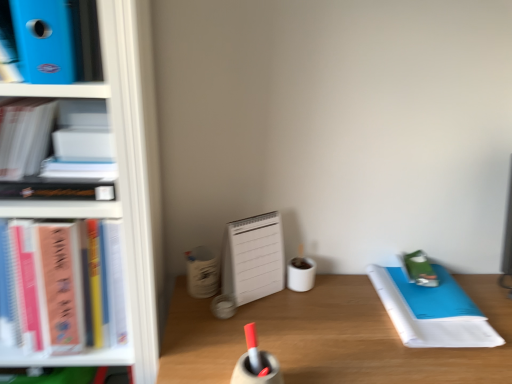
Question: Is wooden desk at center shorter than white paper notebook at right?

Choices:
 (A) yes
 (B) no

Answer: (B)

Question: Is wooden desk at center not within white paper notebook at right?

Choices:
 (A) yes
 (B) no

Answer: (A)

Question: From the image's perspective, is wooden desk at center over white paper notebook at right?

Choices:
 (A) no
 (B) yes

Answer: (A)

Question: Can you confirm if wooden desk at center is bigger than white paper notebook at right?

Choices:
 (A) no
 (B) yes

Answer: (B)

Question: Considering the relative sizes of wooden desk at center and white paper notebook at right in the image provided, is wooden desk at center smaller than white paper notebook at right?

Choices:
 (A) no
 (B) yes

Answer: (A)

Question: From a real-world perspective, is green matte notebook at right physically located above or below wooden desk at center?

Choices:
 (A) below
 (B) above

Answer: (B)

Question: Is green matte notebook at right situated inside wooden desk at center or outside?

Choices:
 (A) outside
 (B) inside

Answer: (A)

Question: Considering the relative positions of green matte notebook at right and wooden desk at center in the image provided, is green matte notebook at right to the left or to the right of wooden desk at center?

Choices:
 (A) left
 (B) right

Answer: (B)

Question: Is green matte notebook at right taller or shorter than wooden desk at center?

Choices:
 (A) short
 (B) tall

Answer: (A)

Question: Is white paper notebook at right in front of or behind pink matte notebook at left, arranged as the 1th book when ordered from the bottom, in the image?

Choices:
 (A) behind
 (B) front

Answer: (A)

Question: Considering the positions of white paper notebook at right and pink matte notebook at left, arranged as the 1th book when ordered from the bottom, in the image, is white paper notebook at right wider or thinner than pink matte notebook at left, arranged as the 1th book when ordered from the bottom,?

Choices:
 (A) wide
 (B) thin

Answer: (A)

Question: Is point (401, 297) positioned closer to the camera than point (86, 279)?

Choices:
 (A) closer
 (B) farther

Answer: (B)

Question: Is white paper notebook at right situated inside pink matte notebook at left, placed as the third book when sorted from top to bottom, or outside?

Choices:
 (A) outside
 (B) inside

Answer: (A)

Question: Is pink matte notebook at left, placed as the third book when sorted from top to bottom, in front of or behind wooden desk at center in the image?

Choices:
 (A) front
 (B) behind

Answer: (A)

Question: Considering the positions of pink matte notebook at left, arranged as the 1th book when ordered from the bottom, and wooden desk at center in the image, is pink matte notebook at left, arranged as the 1th book when ordered from the bottom, bigger or smaller than wooden desk at center?

Choices:
 (A) small
 (B) big

Answer: (A)